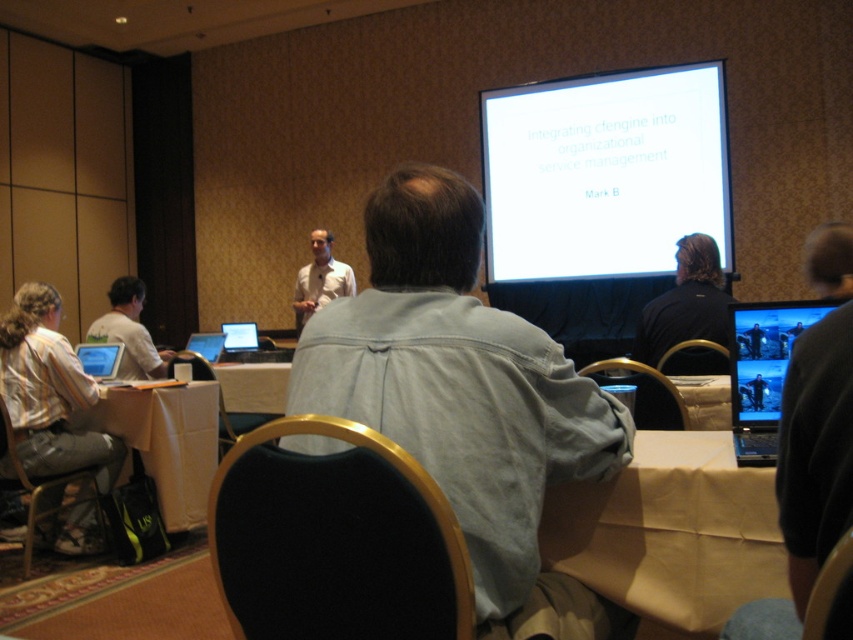
Does brown paper bag at lower right appear over black leather chair at lower right?

No.

Between point (544, 504) and point (844, 554), which one is positioned behind?

Point (544, 504)

Locate an element on the screen. The width and height of the screenshot is (853, 640). brown paper bag at lower right is located at coordinates tap(671, 532).

Which of these two, black plastic chair at center or matte silver laptop at center, stands taller?

With more height is black plastic chair at center.

Is black plastic chair at center wider than matte silver laptop at center?

Yes.

Is point (241, 426) behind point (241, 342)?

No, (241, 426) is in front of (241, 342).

Identify the location of black plastic chair at center. The width and height of the screenshot is (853, 640). (236, 422).

Does matte black screen at upper right appear under black leather chair at center?

No, matte black screen at upper right is not below black leather chair at center.

Does matte black screen at upper right have a lesser width compared to black leather chair at center?

Yes, matte black screen at upper right is thinner than black leather chair at center.

You are a GUI agent. You are given a task and a screenshot of the screen. Output one action in this format:
    pyautogui.click(x=<x>, y=<y>)
    Task: Click on the matte black screen at upper right
    This screenshot has width=853, height=640.
    Given the screenshot: What is the action you would take?
    pyautogui.click(x=764, y=355)

Image resolution: width=853 pixels, height=640 pixels. In order to click on matte black screen at upper right in this screenshot , I will do `click(764, 355)`.